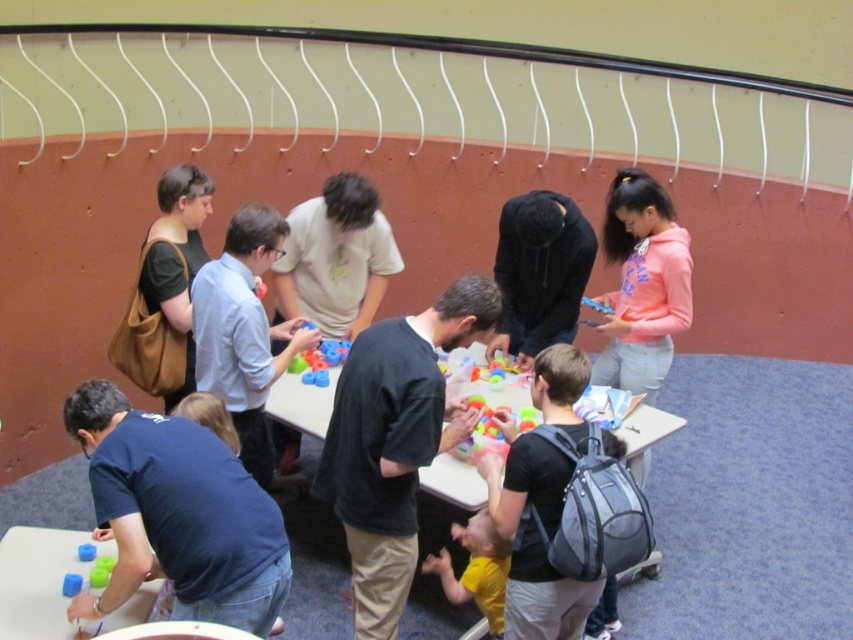
Question: Observing the image, what is the correct spatial positioning of matte black backpack at center in reference to blue plastic cup at lower left?

Choices:
 (A) right
 (B) left

Answer: (A)

Question: Among these objects, which one is farthest from the camera?

Choices:
 (A) black matte shirt at center
 (B) rubberized green cube at lower left
 (C) matte black backpack at center
 (D) yellow matte shirt at lower center

Answer: (D)

Question: Which point is closer to the camera?

Choices:
 (A) (56, 540)
 (B) (654, 433)
 (C) (309, 372)
 (D) (393, 385)

Answer: (D)

Question: Is black matte shirt at center wider than smooth plastic toy at lower left?

Choices:
 (A) no
 (B) yes

Answer: (B)

Question: Which object is closer to the camera taking this photo?

Choices:
 (A) light blue shirt at center
 (B) yellow matte shirt at lower center

Answer: (B)

Question: Observing the image, what is the correct spatial positioning of black matte hoodie at center in reference to smooth plastic toy at lower left?

Choices:
 (A) right
 (B) left

Answer: (A)